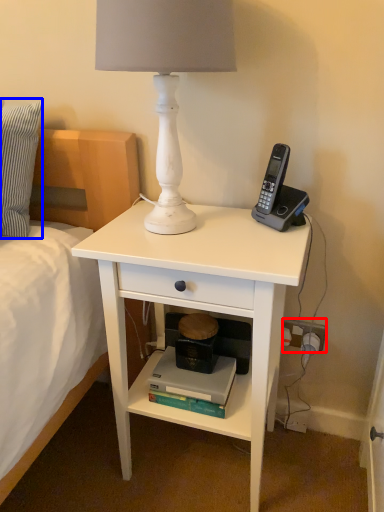
Question: Which point is closer to the camera, power outlet (highlighted by a red box) or pillow (highlighted by a blue box)?

Choices:
 (A) power outlet
 (B) pillow

Answer: (B)